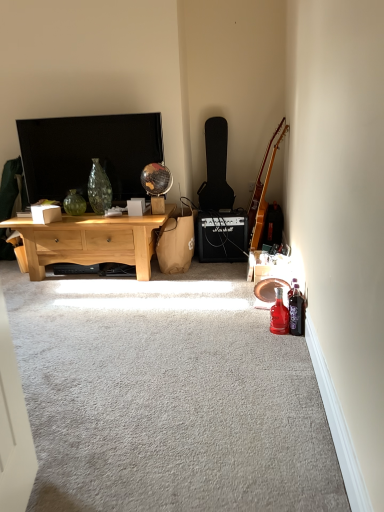
Question: From the image's perspective, relative to matte black tv at upper left, is brown paper bag at center above or below?

Choices:
 (A) above
 (B) below

Answer: (B)

Question: Is point (175, 217) closer or farther from the camera than point (81, 143)?

Choices:
 (A) farther
 (B) closer

Answer: (A)

Question: Which of these objects is positioned farthest from the white cardboard box at center, the first box in the left-to-right sequence?

Choices:
 (A) white matte box at center, which is counted as the first box, starting from the right
 (B) metallic silver mechanical fan at lower right
 (C) black matte amplifier at center
 (D) translucent purple bottle at lower right, which is counted as the 1th bottle, starting from the right
 (E) green glass vase at center

Answer: (D)

Question: Which object is positioned closest to the metallic silver mechanical fan at lower right?

Choices:
 (A) green glass vase at center
 (B) translucent purple bottle at lower right, which is counted as the 1th bottle, starting from the right
 (C) translucent glass bottle at lower right, arranged as the 1th bottle when viewed from the left
 (D) brown paper bag at center
 (E) white cardboard box at center, the first box in the left-to-right sequence

Answer: (C)